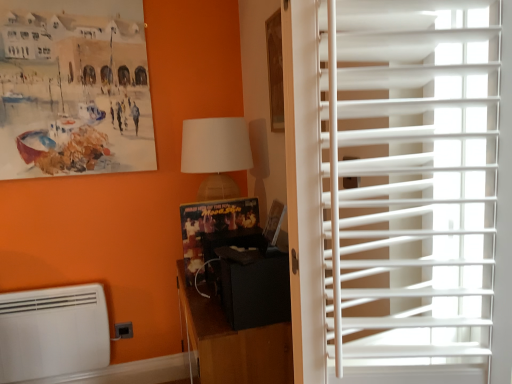
Question: Is white plastic blinds at right situated inside black matte cabinet at center or outside?

Choices:
 (A) inside
 (B) outside

Answer: (B)

Question: Does point (381, 140) appear closer or farther from the camera than point (241, 355)?

Choices:
 (A) farther
 (B) closer

Answer: (B)

Question: Which object is the farthest from the white plastic blinds at right?

Choices:
 (A) white matte air conditioning at lower left
 (B) matte white lampshade at upper center
 (C) black matte cabinet at center

Answer: (A)

Question: Estimate the real-world distances between objects in this image. Which object is closer to the white plastic blinds at right?

Choices:
 (A) white matte air conditioning at lower left
 (B) matte white lampshade at upper center
 (C) black matte cabinet at center

Answer: (C)